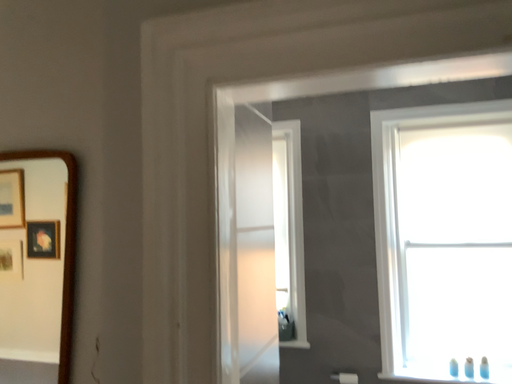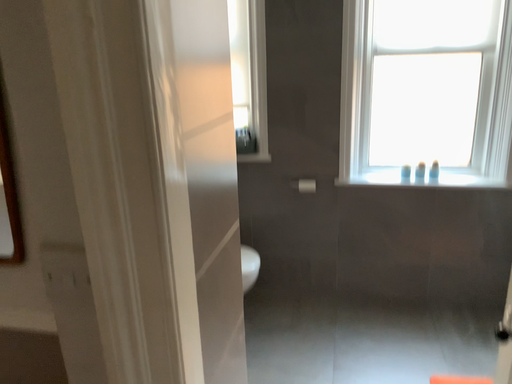
Question: How did the camera likely rotate when shooting the video?

Choices:
 (A) rotated downward
 (B) rotated upward

Answer: (A)